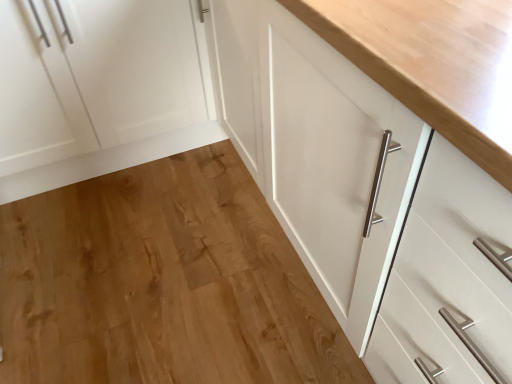
What do you see at coordinates (162, 283) in the screenshot?
I see `natural wood floor at center` at bounding box center [162, 283].

This screenshot has height=384, width=512. In order to click on natural wood floor at center in this screenshot , I will do `click(162, 283)`.

In order to face white matte cabinet at left, should I rotate leftwards or rightwards?

Turn left approximately 22.257 degrees to face it.

Locate an element on the screen. white matte cabinet at left is located at coordinates (99, 90).

The image size is (512, 384). What do you see at coordinates (99, 90) in the screenshot?
I see `white matte cabinet at left` at bounding box center [99, 90].

Find the location of `natural wood floor at center`. natural wood floor at center is located at coordinates (162, 283).

Would you say white matte cabinet at left is to the left or to the right of natural wood floor at center in the picture?

white matte cabinet at left is positioned on natural wood floor at center's left side.

Consider the image. Is white matte cabinet at left closer to the viewer compared to natural wood floor at center?

That is False.

Considering the points (3, 201) and (143, 285), which point is in front, point (3, 201) or point (143, 285)?

Point (143, 285)

From the image's perspective, is white matte cabinet at left located beneath natural wood floor at center?

Incorrect, from the image's perspective, white matte cabinet at left is higher than natural wood floor at center.

From a real-world perspective, who is located lower, white matte cabinet at left or natural wood floor at center?

In real-world perspective, natural wood floor at center is lower.

Which of these two, white matte cabinet at left or natural wood floor at center, is wider?

Wider between the two is natural wood floor at center.

From the picture: Does white matte cabinet at left have a greater height compared to natural wood floor at center?

Yes, white matte cabinet at left is taller than natural wood floor at center.

Consider the image. Can you confirm if white matte cabinet at left is bigger than natural wood floor at center?

Yes.

Is white matte cabinet at left not within natural wood floor at center?

white matte cabinet at left is positioned outside natural wood floor at center.

Are white matte cabinet at left and natural wood floor at center beside each other?

No, white matte cabinet at left is not next to natural wood floor at center.

Is white matte cabinet at left positioned with its back to natural wood floor at center?

No, white matte cabinet at left's orientation is not away from natural wood floor at center.

How different are the orientations of white matte cabinet at left and natural wood floor at center in degrees?

white matte cabinet at left and natural wood floor at center are facing 90.7 degrees away from each other.

How much distance is there between white matte cabinet at left and natural wood floor at center?

A distance of 20.12 inches exists between white matte cabinet at left and natural wood floor at center.

The height and width of the screenshot is (384, 512). Identify the location of hardwood in front of the white matte cabinet at left. (162, 283).

Which object is positioned more to the left, natural wood floor at center or white matte cabinet at left?

white matte cabinet at left.

Which is behind, natural wood floor at center or white matte cabinet at left?

white matte cabinet at left is further from the camera.

Considering the positions of point (22, 208) and point (17, 84), is point (22, 208) closer or farther from the camera than point (17, 84)?

Point (22, 208) is farther from the camera than point (17, 84).

From the image's perspective, between natural wood floor at center and white matte cabinet at left, which one is located above?

white matte cabinet at left, from the image's perspective.

From a real-world perspective, who is located higher, natural wood floor at center or white matte cabinet at left?

white matte cabinet at left, from a real-world perspective.

Which of these two, natural wood floor at center or white matte cabinet at left, is wider?

Wider between the two is natural wood floor at center.

Considering the sizes of natural wood floor at center and white matte cabinet at left in the image, is natural wood floor at center taller or shorter than white matte cabinet at left?

natural wood floor at center is shorter than white matte cabinet at left.

Between natural wood floor at center and white matte cabinet at left, which one has larger size?

With larger size is white matte cabinet at left.

Is natural wood floor at center not inside white matte cabinet at left?

Indeed, natural wood floor at center is completely outside white matte cabinet at left.

Is natural wood floor at center directly adjacent to white matte cabinet at left?

natural wood floor at center and white matte cabinet at left are clearly separated.

From the picture: Is natural wood floor at center aimed at white matte cabinet at left?

No, natural wood floor at center is not oriented towards white matte cabinet at left.

Can you tell me how much natural wood floor at center and white matte cabinet at left differ in facing direction?

They differ by 90.7 degrees in their facing directions.

How far apart are natural wood floor at center and white matte cabinet at left?

natural wood floor at center and white matte cabinet at left are 20.12 inches apart from each other.

Where is `hardwood directly beneath the white matte cabinet at left (from a real-world perspective)`? The width and height of the screenshot is (512, 384). hardwood directly beneath the white matte cabinet at left (from a real-world perspective) is located at coordinates (162, 283).

The height and width of the screenshot is (384, 512). Find the location of `cabinetry above the natural wood floor at center (from the image's perspective)`. cabinetry above the natural wood floor at center (from the image's perspective) is located at coordinates (99, 90).

I want to click on cabinetry behind the natural wood floor at center, so click(x=99, y=90).